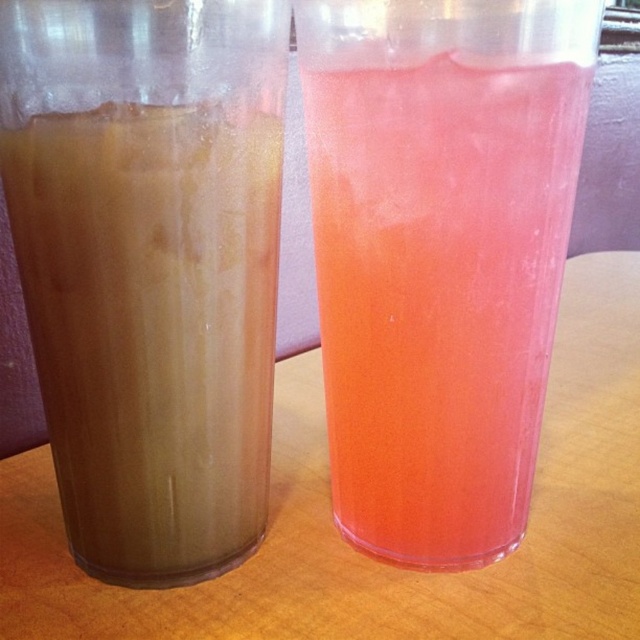
Is translucent orange juice at right closer to camera compared to brown translucent cup at left?

That is False.

Does point (477, 132) come farther from viewer compared to point (257, 266)?

No, it is not.

The image size is (640, 640). I want to click on translucent orange juice at right, so click(438, 292).